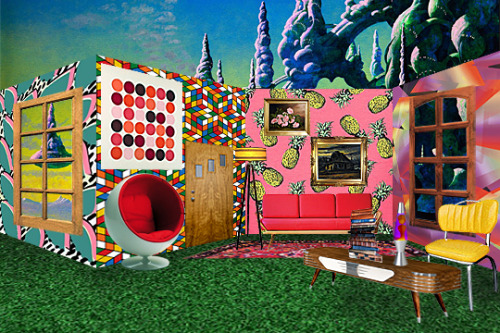
Locate an element on the screen. couch is located at coordinates (303, 216).